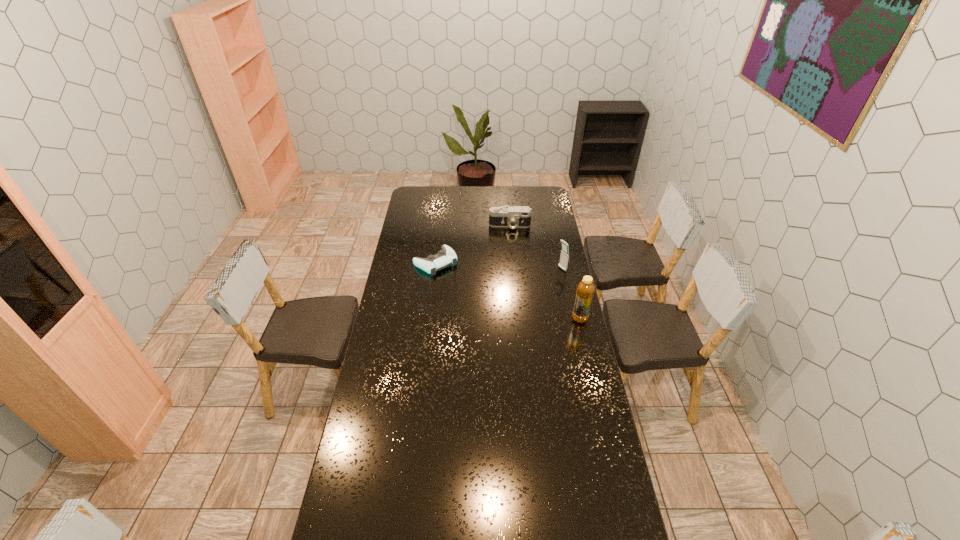
Locate an element on the screen. free space at the left edge is located at coordinates (372, 394).

This screenshot has width=960, height=540. Find the location of `vacant space at the right edge of the desktop`. vacant space at the right edge of the desktop is located at coordinates (551, 218).

Find the location of a particular element. The height and width of the screenshot is (540, 960). vacant region at the far right corner of the desktop is located at coordinates click(542, 201).

Identify the location of vacant space that is in between the camera and the nearest object. (545, 272).

You are a GUI agent. You are given a task and a screenshot of the screen. Output one action in this format:
    pyautogui.click(x=<x>, y=<y>)
    Task: Click on the free space between the second shortest object and the tallest object
    Image resolution: width=960 pixels, height=540 pixels.
    Given the screenshot: What is the action you would take?
    pyautogui.click(x=545, y=272)

The image size is (960, 540). What are the coordinates of `vacant area that lies between the nearest object and the second shortest object` in the screenshot? It's located at (545, 272).

Identify the location of blank region between the shortest object and the camera. point(472,244).

Find the location of a particular element. free area in between the control and the camera is located at coordinates (472, 244).

This screenshot has width=960, height=540. I want to click on free spot between the bottle and the cellular telephone, so click(x=571, y=294).

Image resolution: width=960 pixels, height=540 pixels. What are the coordinates of `free space between the camera and the shortest object` in the screenshot? It's located at (472, 244).